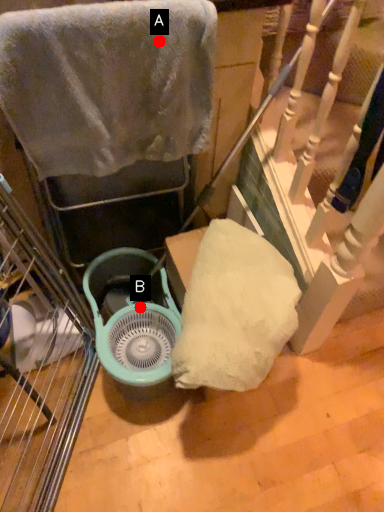
Question: Two points are circled on the image, labeled by A and B beside each circle. Which point is farther from the camera taking this photo?

Choices:
 (A) A is further
 (B) B is further

Answer: (B)